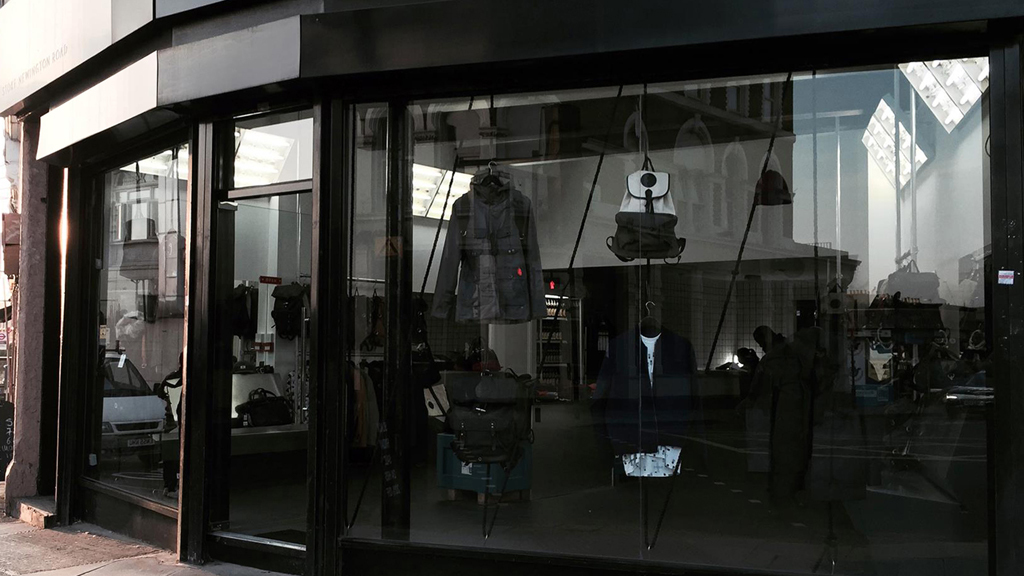
This screenshot has height=576, width=1024. What are the coordinates of `door` in the screenshot? It's located at (300, 420).